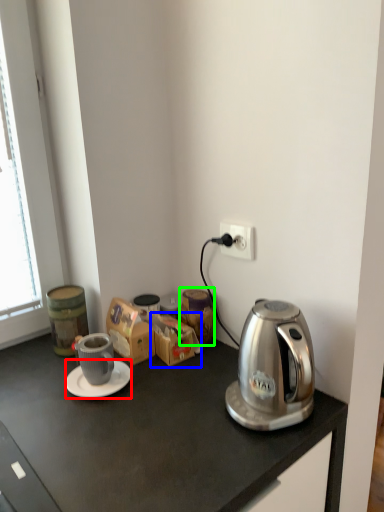
Question: Considering the real-world distances, which object is farthest from saucer (highlighted by a red box)? cardboard box (highlighted by a blue box) or appliance (highlighted by a green box)?

Choices:
 (A) cardboard box
 (B) appliance

Answer: (B)